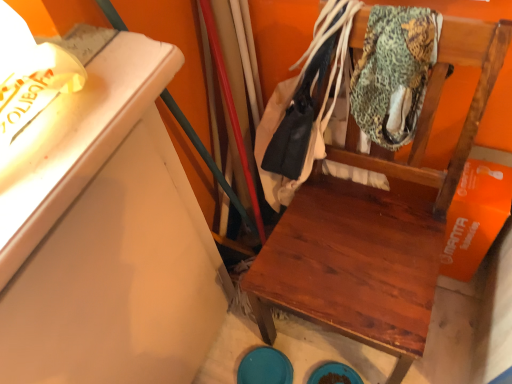
Question: Based on their sizes in the image, would you say wooden chair at center is bigger or smaller than textured green fabric at upper right?

Choices:
 (A) big
 (B) small

Answer: (A)

Question: In terms of width, does wooden chair at center look wider or thinner when compared to textured green fabric at upper right?

Choices:
 (A) thin
 (B) wide

Answer: (B)

Question: Considering the real-world distances, which object is closest to the textured green fabric at upper right?

Choices:
 (A) leather jacket at center
 (B) wooden chair at center

Answer: (B)

Question: Which object is positioned farthest from the wooden chair at center?

Choices:
 (A) textured green fabric at upper right
 (B) leather jacket at center

Answer: (B)